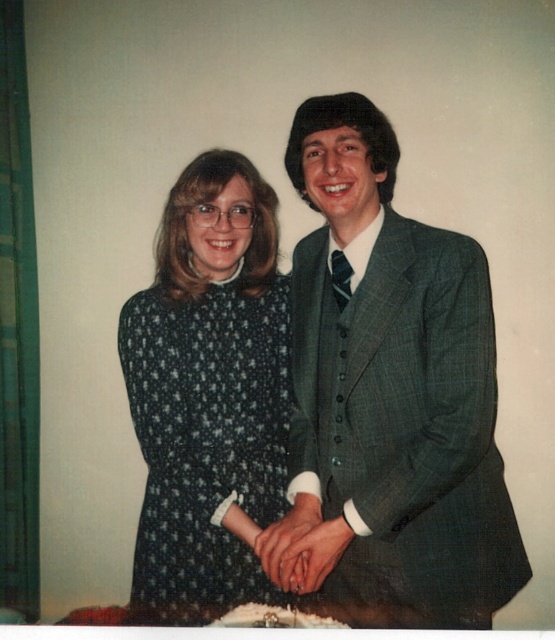
Question: Does dark blue dotted fabric dress at center lie in front of smooth skin hands at center?

Choices:
 (A) no
 (B) yes

Answer: (A)

Question: Considering the relative positions of green textured suit at center and smooth skin hands at center in the image provided, where is green textured suit at center located with respect to smooth skin hands at center?

Choices:
 (A) below
 (B) above

Answer: (B)

Question: Which object appears closest to the camera in this image?

Choices:
 (A) smooth skin hands at center
 (B) matte black hand at center
 (C) dark blue dotted fabric dress at center

Answer: (B)

Question: Which of these objects is positioned closest to the dark blue dotted fabric dress at center?

Choices:
 (A) green textured suit at center
 (B) smooth skin hands at center
 (C) matte black hand at center

Answer: (A)

Question: Is green textured suit at center to the left of matte black hand at center from the viewer's perspective?

Choices:
 (A) no
 (B) yes

Answer: (A)

Question: Which of the following is the closest to the observer?

Choices:
 (A) (331, 522)
 (B) (216, 288)
 (C) (370, 282)
 (D) (279, 532)

Answer: (A)